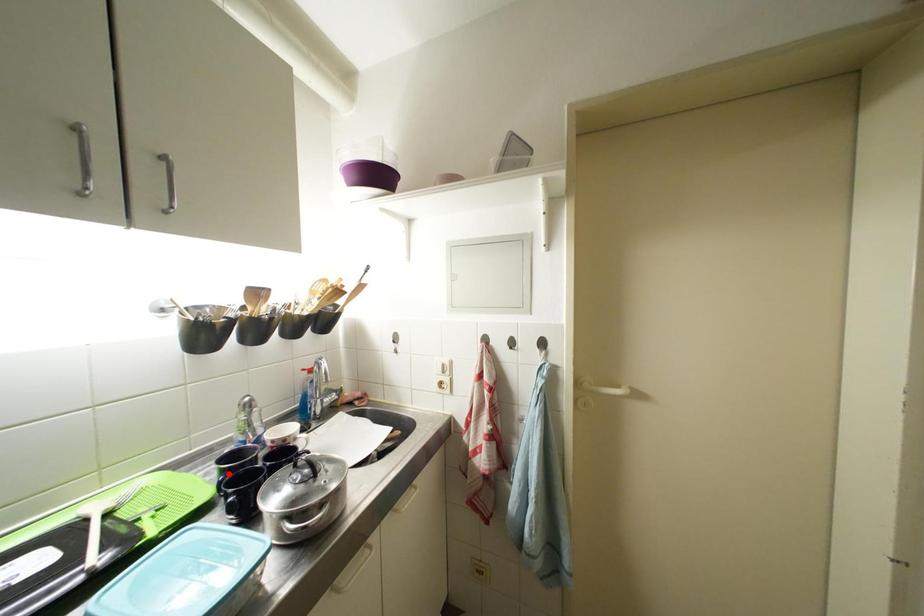
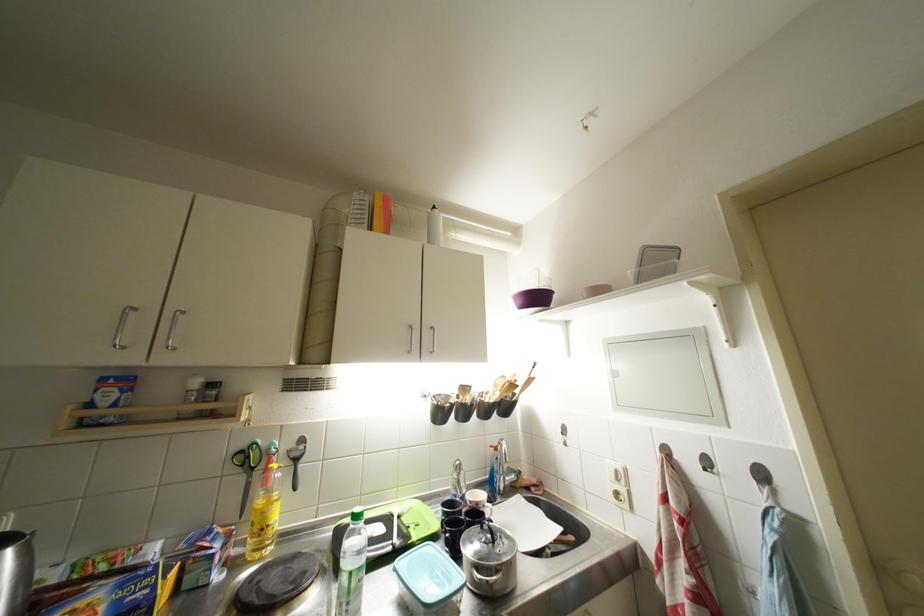
Locate, in the second image, the point that corresponds to the highlighted location in the first image.

(451, 516)